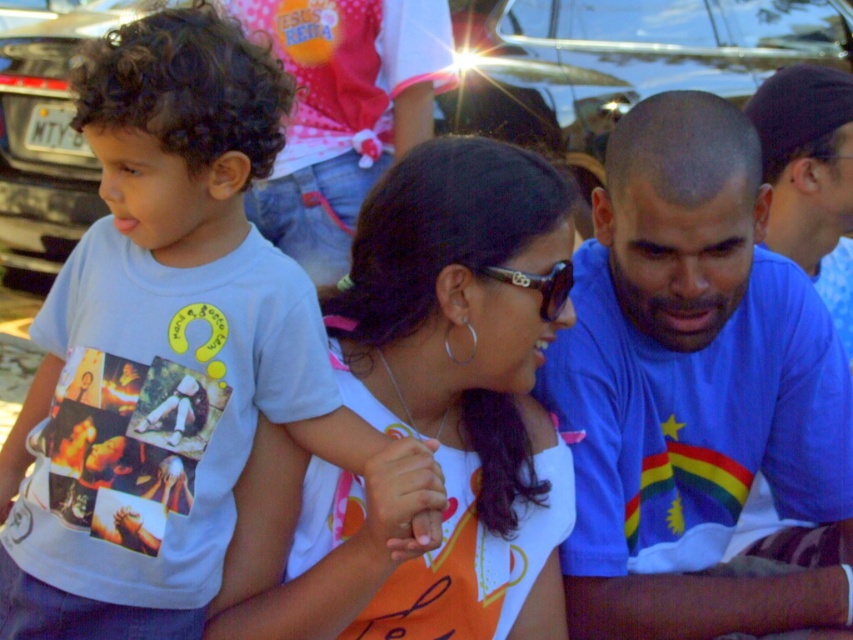
Based on the scene description, where is the shiny black car at upper center located in terms of coordinates?

The shiny black car at upper center is located at coordinates point [618,61].

Consider the image. You are a photographer trying to capture a group photo of the two children and the adult male. The adult male is standing behind the children. You want to ensure that the white cotton shirt at center and the sunglasses at center are both visible in the photo. Based on their sizes, which object should you focus on to ensure both are visible?

The white cotton shirt at center is larger in size than the sunglasses at center. Therefore, focusing on the white cotton shirt at center will ensure both objects are visible as it is bigger and can be easily captured in the frame.